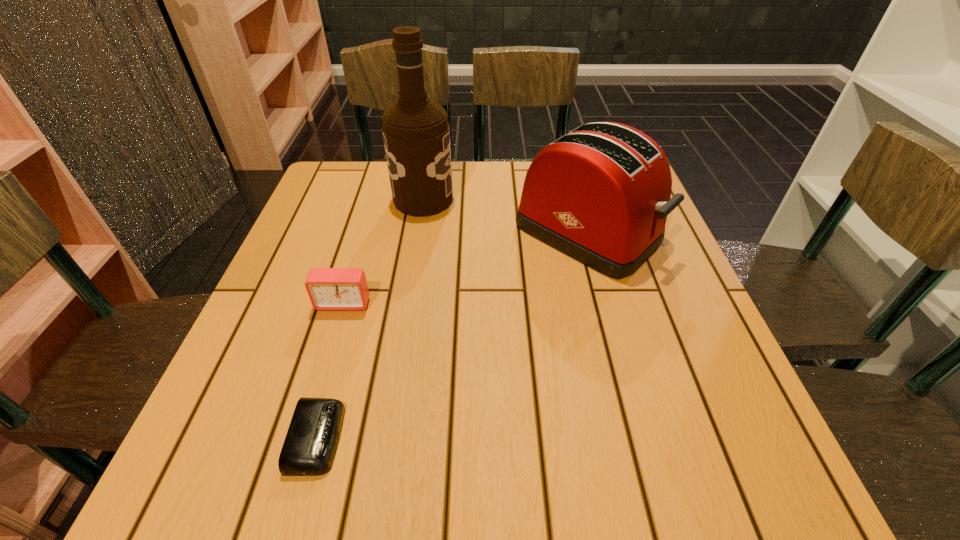
Image resolution: width=960 pixels, height=540 pixels. In order to click on free space located on the display of the shorter alarm clock in this screenshot , I will do `click(525, 437)`.

You are a GUI agent. You are given a task and a screenshot of the screen. Output one action in this format:
    pyautogui.click(x=<x>, y=<y>)
    Task: Click on the alcohol at the far edge
    
    Given the screenshot: What is the action you would take?
    pyautogui.click(x=416, y=132)

Locate an element on the screen. toaster located in the far edge section of the desktop is located at coordinates (600, 194).

The width and height of the screenshot is (960, 540). Find the location of `object present at the near edge`. object present at the near edge is located at coordinates (310, 444).

This screenshot has height=540, width=960. In order to click on object situated at the right edge in this screenshot , I will do `click(600, 194)`.

The image size is (960, 540). What are the coordinates of `object that is at the near left corner` in the screenshot? It's located at (310, 444).

Identify the location of object that is at the far right corner. The height and width of the screenshot is (540, 960). (600, 194).

You are a GUI agent. You are given a task and a screenshot of the screen. Output one action in this format:
    pyautogui.click(x=<x>, y=<y>)
    Task: Click on the free region at the far edge of the desktop
    
    Given the screenshot: What is the action you would take?
    465,207

Locate an element on the screen. The image size is (960, 540). free region at the near edge is located at coordinates (516, 483).

The height and width of the screenshot is (540, 960). Identify the location of free space at the left edge of the desktop. (305, 248).